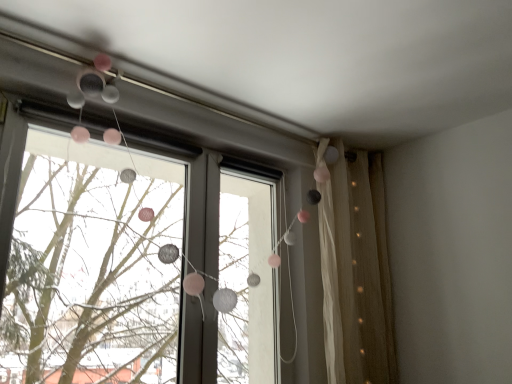
Question: Does matte silver garland at upper center lie in front of beige sheer curtain at right?

Choices:
 (A) no
 (B) yes

Answer: (B)

Question: Is matte silver garland at upper center oriented away from beige sheer curtain at right?

Choices:
 (A) no
 (B) yes

Answer: (A)

Question: From the image's perspective, is matte silver garland at upper center on beige sheer curtain at right?

Choices:
 (A) no
 (B) yes

Answer: (B)

Question: From the image's perspective, is matte silver garland at upper center under beige sheer curtain at right?

Choices:
 (A) no
 (B) yes

Answer: (A)

Question: Is beige sheer curtain at right located within matte silver garland at upper center?

Choices:
 (A) yes
 (B) no

Answer: (B)

Question: Does matte silver garland at upper center turn towards beige sheer curtain at right?

Choices:
 (A) no
 (B) yes

Answer: (A)

Question: Is beige sheer curtain at right positioned beyond the bounds of matte silver garland at upper center?

Choices:
 (A) yes
 (B) no

Answer: (A)

Question: Is beige sheer curtain at right wider than matte silver garland at upper center?

Choices:
 (A) no
 (B) yes

Answer: (B)

Question: Does beige sheer curtain at right have a lesser width compared to matte silver garland at upper center?

Choices:
 (A) yes
 (B) no

Answer: (B)

Question: Is beige sheer curtain at right shorter than matte silver garland at upper center?

Choices:
 (A) no
 (B) yes

Answer: (A)

Question: Is beige sheer curtain at right further to camera compared to matte silver garland at upper center?

Choices:
 (A) yes
 (B) no

Answer: (A)

Question: From a real-world perspective, is beige sheer curtain at right located beneath matte silver garland at upper center?

Choices:
 (A) no
 (B) yes

Answer: (B)

Question: Considering the positions of matte silver garland at upper center and beige sheer curtain at right in the image, is matte silver garland at upper center taller or shorter than beige sheer curtain at right?

Choices:
 (A) short
 (B) tall

Answer: (A)